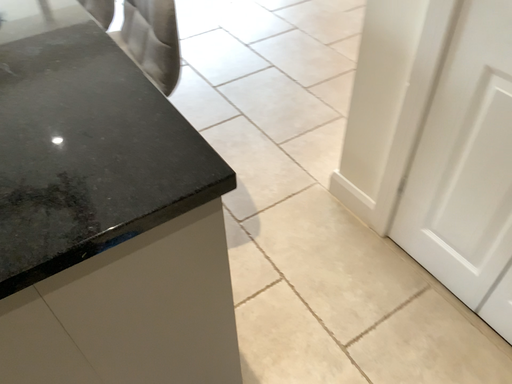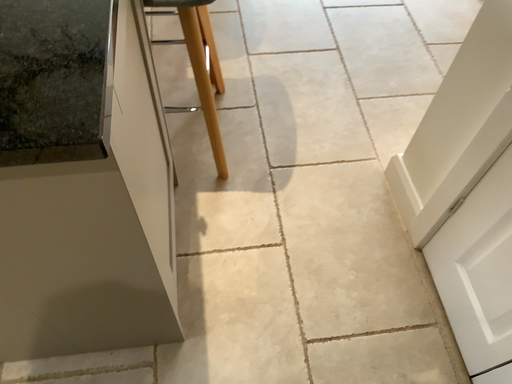
Question: How did the camera likely rotate when shooting the video?

Choices:
 (A) rotated upward
 (B) rotated downward

Answer: (B)